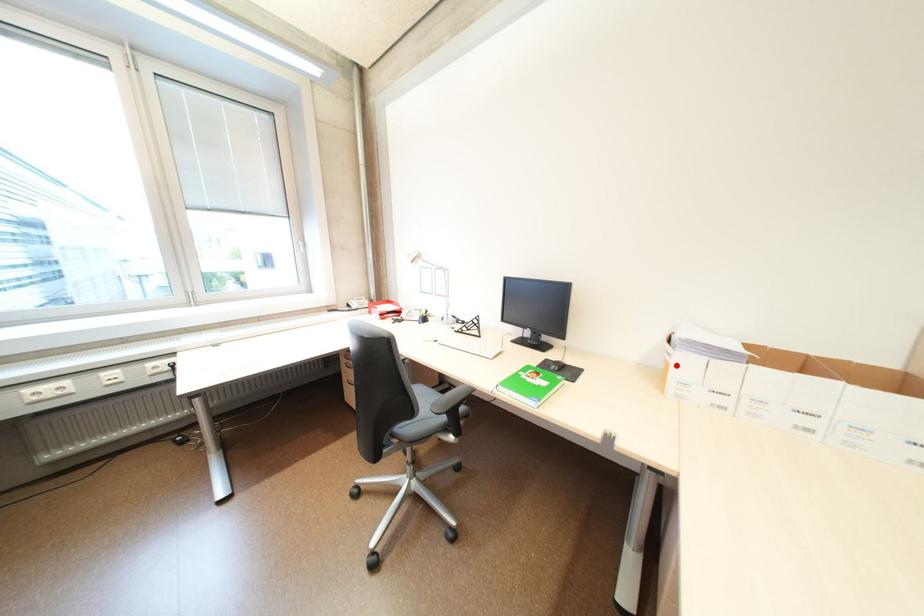
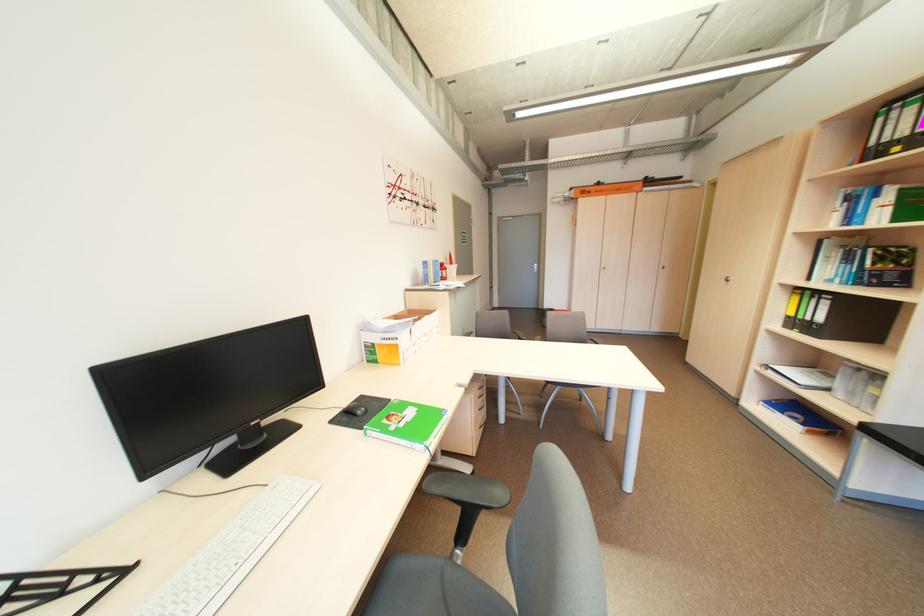
Find the pixel in the second image that matches the highlighted location in the first image.

(406, 347)